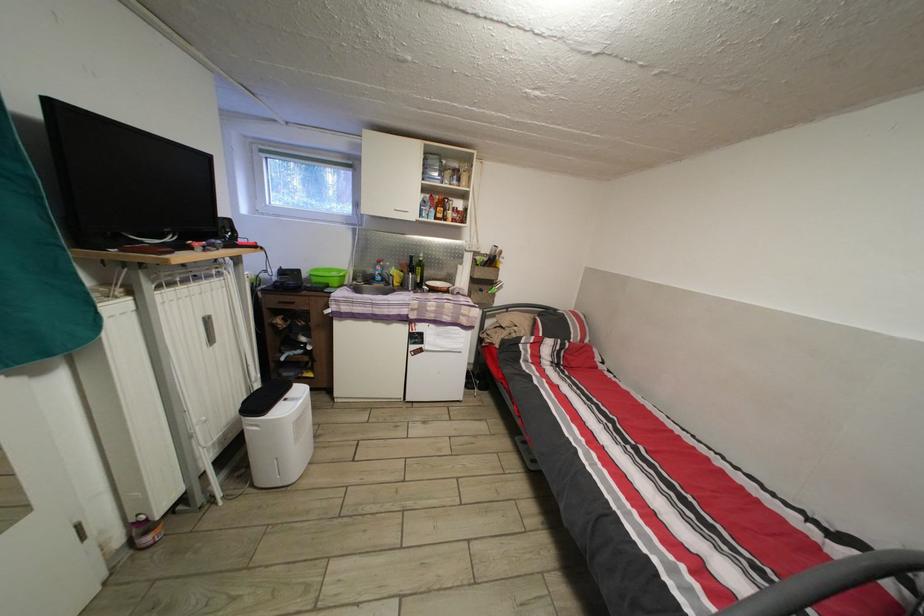
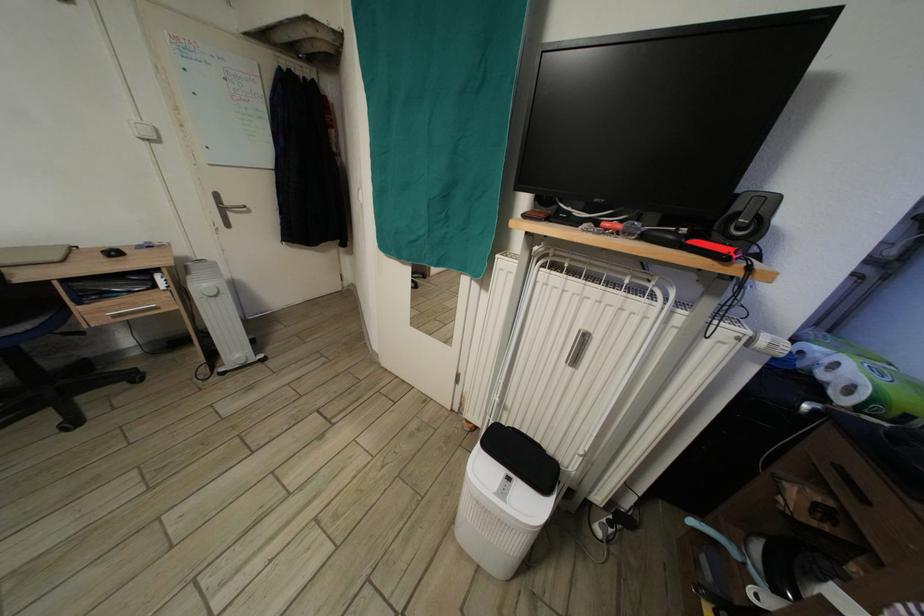
Where in the second image is the point corresponding to point 227,231 from the first image?

(744, 214)